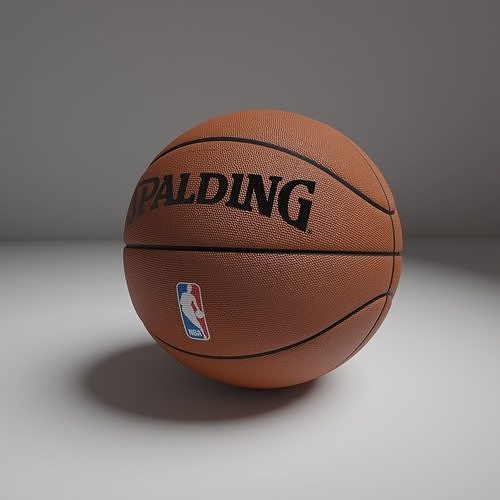
You are a GUI agent. You are given a task and a screenshot of the screen. Output one action in this format:
    pyautogui.click(x=<x>, y=<y>)
    Task: Click on the counter
    The image size is (500, 500).
    Given the screenshot: What is the action you would take?
    pyautogui.click(x=62, y=483)